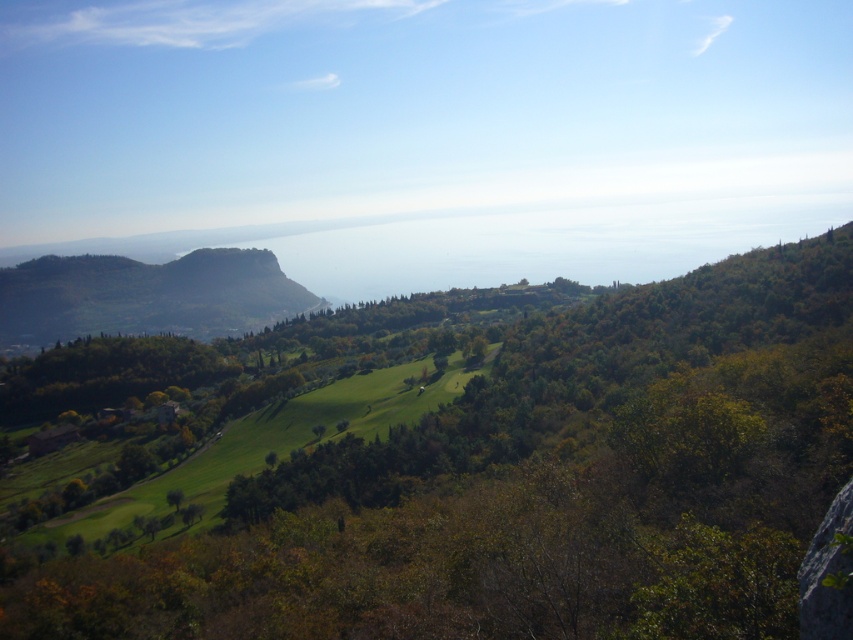
You are standing at the origin point in the image. Where is the green leafy tree at center located in relation to your position?

The green leafy tree at center is located at coordinates point (535, 486) relative to your position.

You are standing on a path in the middle of the image and want to take a photo of both the green leafy tree at center and the green forested mountain at left. Which object should you position closer to the bottom of your camera frame?

You should position the green leafy tree at center closer to the bottom of your camera frame because it is located below the green forested mountain at left in the image.